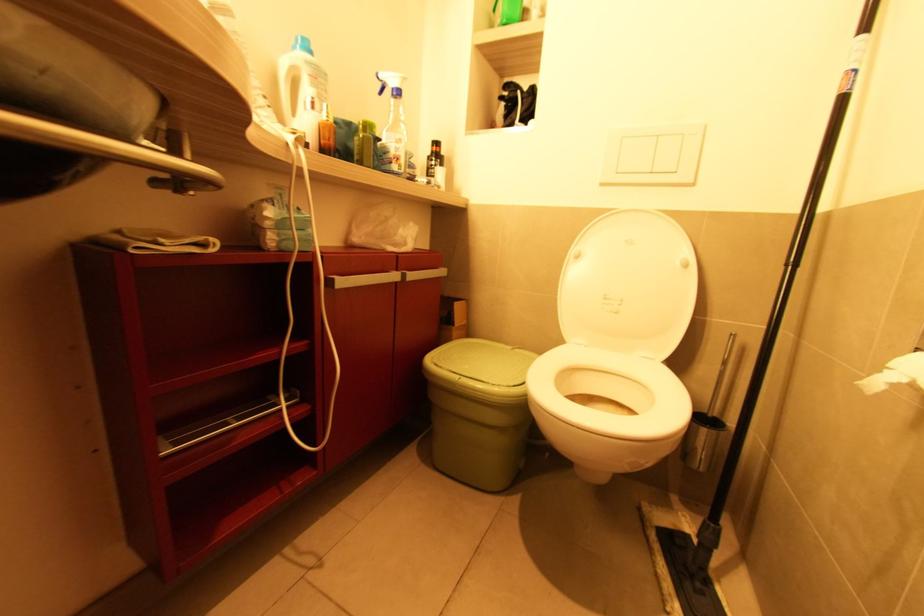
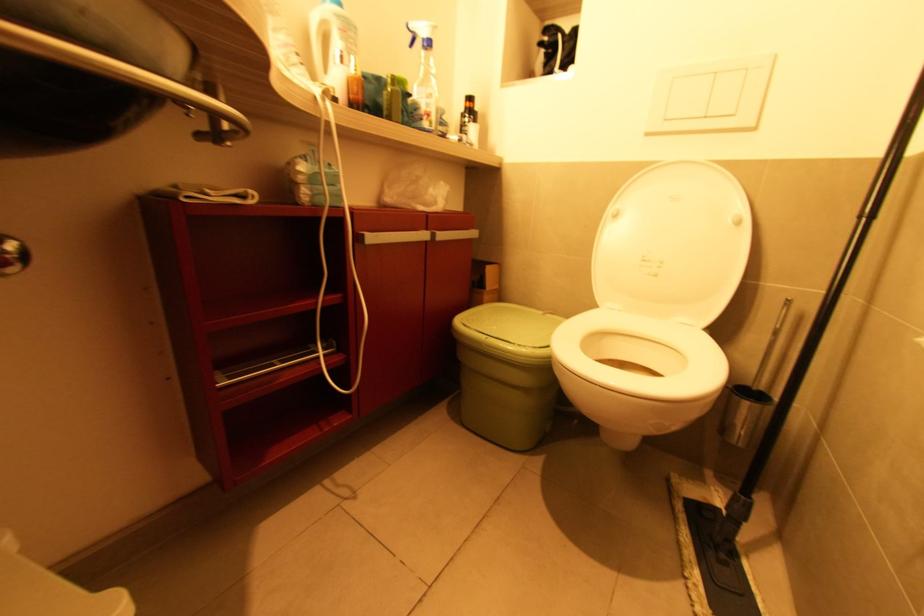
In the second image, find the point that corresponds to the point at 718,368 in the first image.

(771, 338)